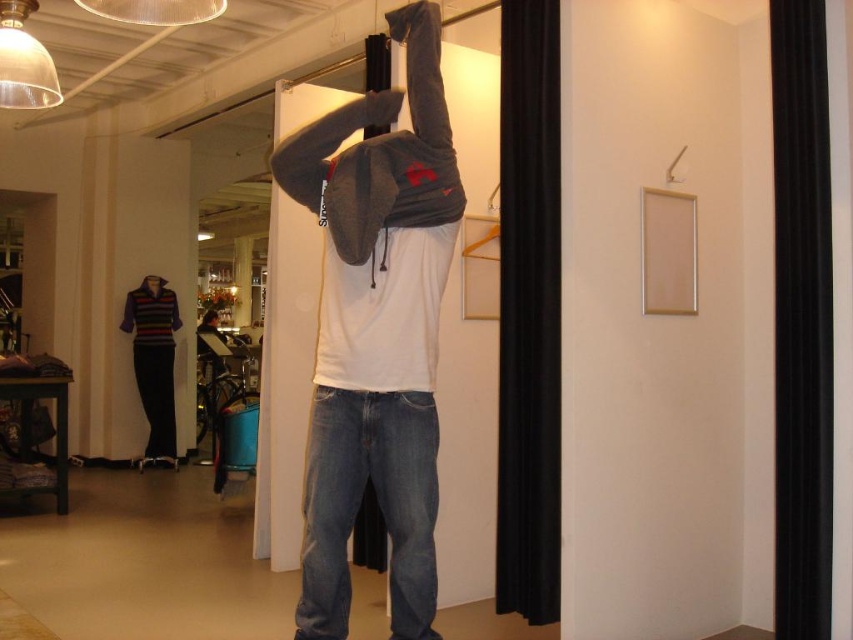
Question: Which of the following is the closest to the observer?

Choices:
 (A) matte gray hoodie at center
 (B) wooden hanger at upper center

Answer: (A)

Question: Does matte gray hoodie at center appear over wooden hanger at upper center?

Choices:
 (A) yes
 (B) no

Answer: (B)

Question: Does matte gray hoodie at center have a greater width compared to wooden hanger at upper center?

Choices:
 (A) no
 (B) yes

Answer: (B)

Question: Which object appears farthest from the camera in this image?

Choices:
 (A) matte gray hoodie at center
 (B) wooden hanger at upper center

Answer: (B)

Question: Can you confirm if matte gray hoodie at center is thinner than wooden hanger at upper center?

Choices:
 (A) yes
 (B) no

Answer: (B)

Question: Which object is farther from the camera taking this photo?

Choices:
 (A) wooden hanger at upper center
 (B) matte gray hoodie at center

Answer: (A)